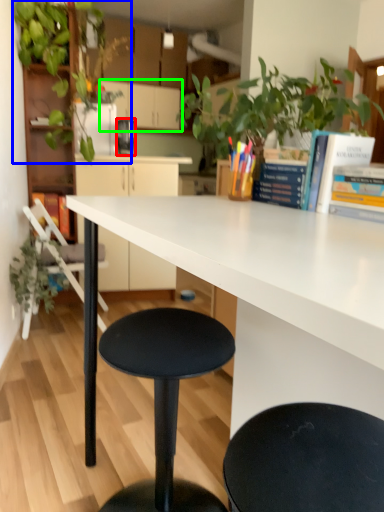
Question: Which object is the closest to the appliance (highlighted by a red box)? Choose among these: vegetation (highlighted by a blue box) or cabinetry (highlighted by a green box).

Choices:
 (A) vegetation
 (B) cabinetry

Answer: (A)